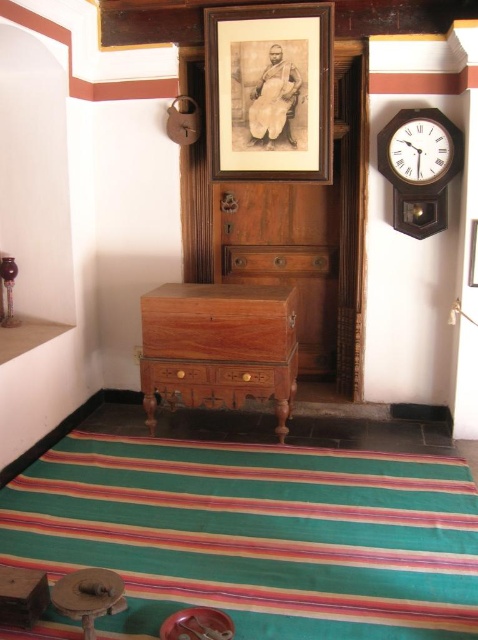
Question: Which object appears farthest from the camera in this image?

Choices:
 (A) wooden frame at upper center
 (B) wooden drawer at center

Answer: (A)

Question: Observing the image, what is the correct spatial positioning of wooden frame at upper center in reference to wooden picture frame at upper center?

Choices:
 (A) below
 (B) above

Answer: (B)

Question: Where is wooden clock at upper right located in relation to brown wood drawer at center in the image?

Choices:
 (A) left
 (B) right

Answer: (B)

Question: Estimate the real-world distances between objects in this image. Which object is closer to the wooden picture frame at upper center?

Choices:
 (A) wooden frame at upper center
 (B) wooden drawer at center

Answer: (B)

Question: Considering the real-world distances, which object is farthest from the wooden picture frame at upper center?

Choices:
 (A) wooden clock at upper right
 (B) brown wood drawer at center

Answer: (B)

Question: Does striped fabric mat at lower center come behind wooden frame at upper center?

Choices:
 (A) yes
 (B) no

Answer: (B)